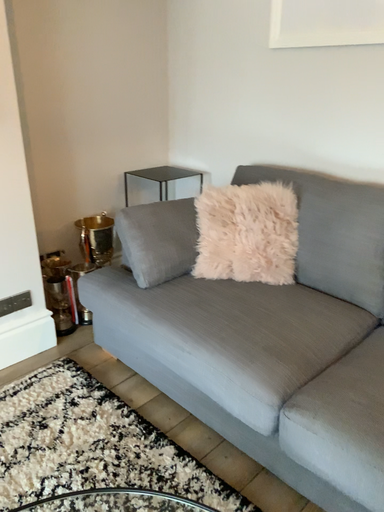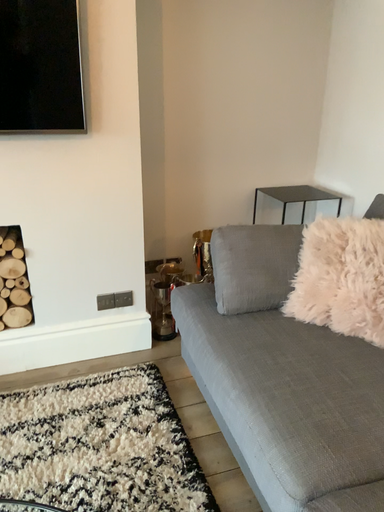
Question: Which way did the camera rotate in the video?

Choices:
 (A) rotated right
 (B) rotated left

Answer: (B)